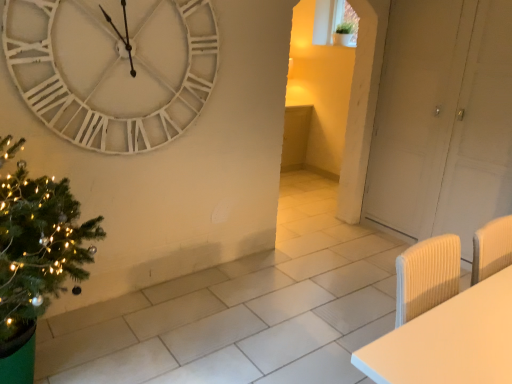
Question: Is white wooden clock at upper left smaller than white ribbed chair at lower right?

Choices:
 (A) yes
 (B) no

Answer: (A)

Question: From a real-world perspective, is white wooden clock at upper left physically above white ribbed chair at lower right?

Choices:
 (A) yes
 (B) no

Answer: (A)

Question: Does white wooden clock at upper left have a greater height compared to white ribbed chair at lower right?

Choices:
 (A) no
 (B) yes

Answer: (B)

Question: Does white wooden clock at upper left have a lesser width compared to white ribbed chair at lower right?

Choices:
 (A) yes
 (B) no

Answer: (A)

Question: Does white wooden clock at upper left have a larger size compared to white ribbed chair at lower right?

Choices:
 (A) no
 (B) yes

Answer: (A)

Question: Is white wooden clock at upper left further to camera compared to white ribbed chair at lower right?

Choices:
 (A) no
 (B) yes

Answer: (B)

Question: Is white wooden clock at upper left aimed at white matte door at right?

Choices:
 (A) no
 (B) yes

Answer: (A)

Question: From the image's perspective, does white wooden clock at upper left appear higher than white matte door at right?

Choices:
 (A) yes
 (B) no

Answer: (A)

Question: Is white wooden clock at upper left closer to camera compared to white matte door at right?

Choices:
 (A) yes
 (B) no

Answer: (A)

Question: Is white wooden clock at upper left facing away from white matte door at right?

Choices:
 (A) no
 (B) yes

Answer: (A)

Question: Does white wooden clock at upper left appear on the right side of white matte door at right?

Choices:
 (A) yes
 (B) no

Answer: (B)

Question: From the image's perspective, is white wooden clock at upper left located beneath white matte door at right?

Choices:
 (A) yes
 (B) no

Answer: (B)

Question: From a real-world perspective, is white matte door at right physically below green textured christmas tree at left?

Choices:
 (A) yes
 (B) no

Answer: (B)